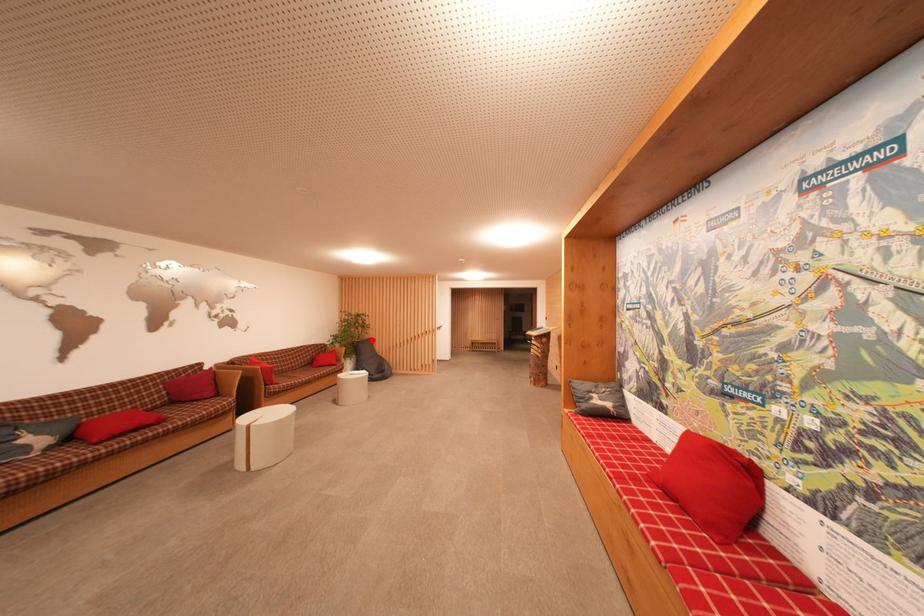
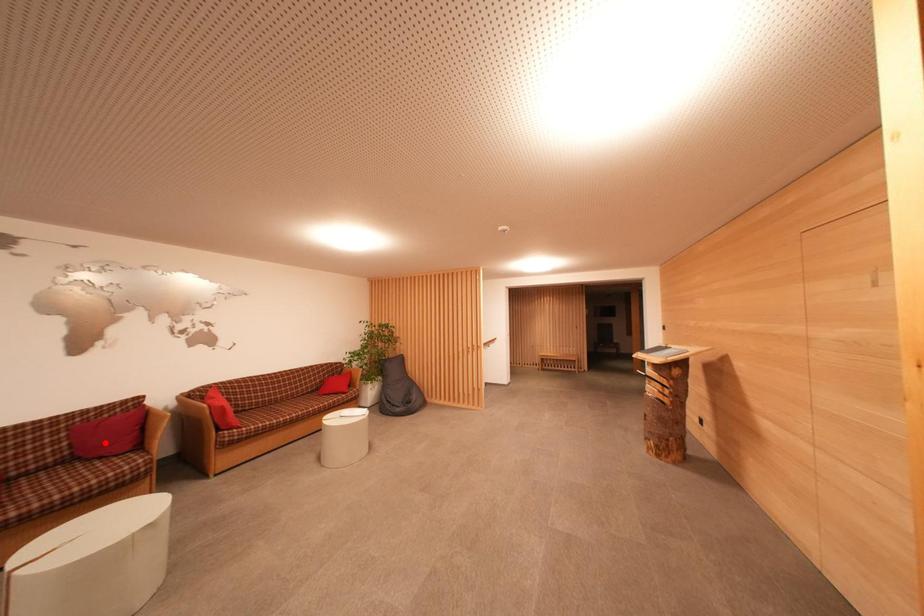
I am providing you with two images of the same scene from different viewpoints. A red point is marked on the first image and another point is marked on the second image. Does the point marked in image1 correspond to the same location as the one in image2?

No